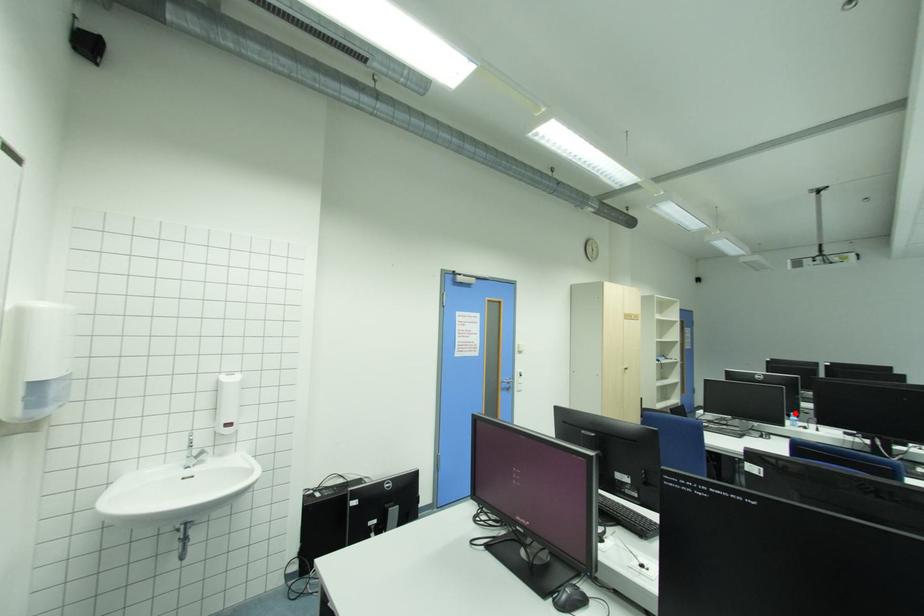
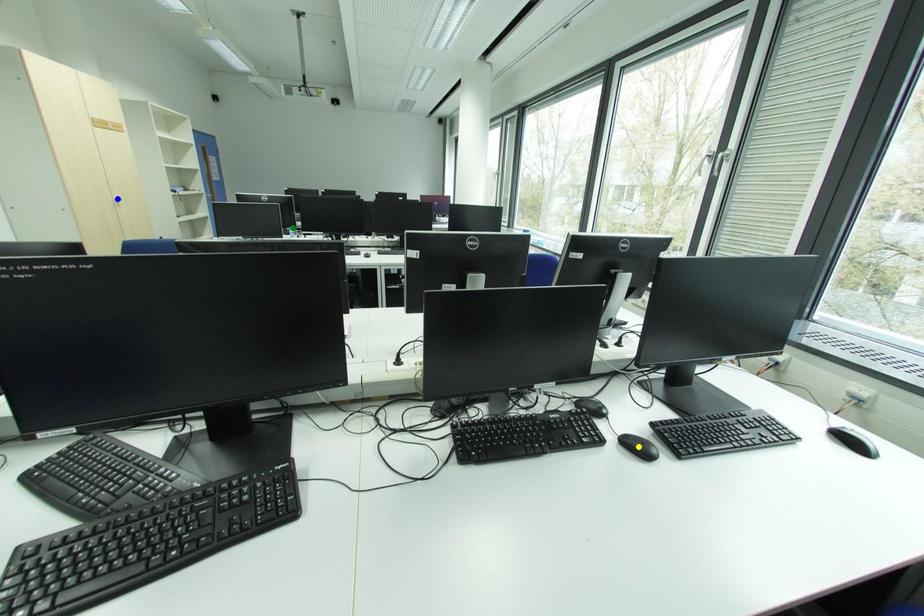
Question: I am providing you with two images of the same scene from different viewpoints. A red point is marked on the first image. You are given multiple points on the second image. Which mark in image 2 goes with the point in image 1?

Choices:
 (A) yellow point
 (B) green point
 (C) blue point

Answer: (B)